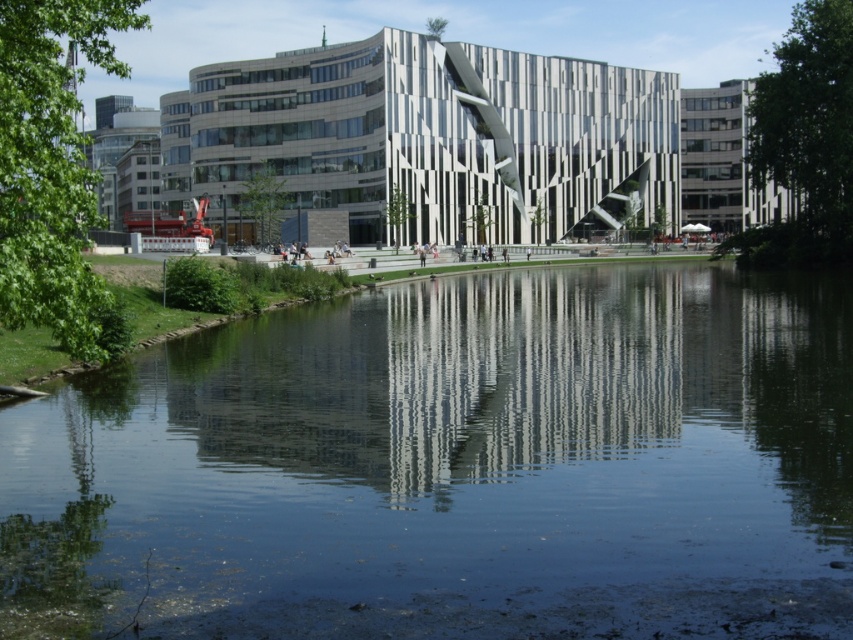
Question: Can you confirm if transparent water at center is smaller than white striped building at center?

Choices:
 (A) no
 (B) yes

Answer: (B)

Question: Which of the following is the closest to the observer?

Choices:
 (A) (270, 579)
 (B) (466, 44)

Answer: (A)

Question: Which point is closer to the camera?

Choices:
 (A) transparent water at center
 (B) white striped building at center

Answer: (A)

Question: Does transparent water at center come behind white striped building at center?

Choices:
 (A) no
 (B) yes

Answer: (A)

Question: Is transparent water at center to the left of white striped building at center from the viewer's perspective?

Choices:
 (A) no
 (B) yes

Answer: (B)